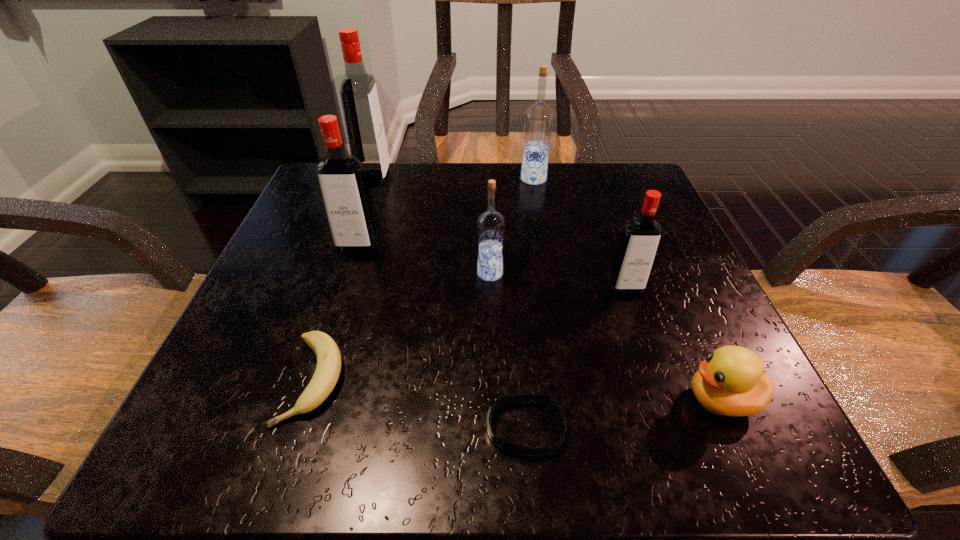
In order to click on vacant space located 0.290m on the face of the duckling in this screenshot , I will do `click(461, 400)`.

Find the location of a particular element. free space located on the face of the duckling is located at coordinates (422, 400).

Identify the location of free location located on the face of the duckling. The height and width of the screenshot is (540, 960). (468, 400).

The image size is (960, 540). Find the location of `free location located on the display of the wristband`. free location located on the display of the wristband is located at coordinates (349, 428).

Locate an element on the screen. free spot located on the display of the wristband is located at coordinates (276, 428).

At what (x,y) coordinates should I click in order to perform the action: click on free region located 0.170m on the display of the wristband. Please return your answer as a coordinate pair (x, y). Looking at the image, I should click on (349, 428).

Locate an element on the screen. This screenshot has height=540, width=960. duckling that is at the near edge is located at coordinates (731, 382).

Find the location of a particular element. banana that is at the near edge is located at coordinates (328, 368).

I want to click on wristband that is positioned at the near edge, so click(x=511, y=399).

Where is `banana located at the left edge`? banana located at the left edge is located at coordinates (328, 368).